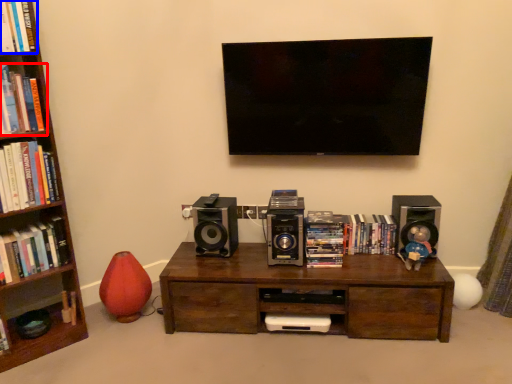
Question: Which point is closer to the camera, book (highlighted by a red box) or book (highlighted by a blue box)?

Choices:
 (A) book
 (B) book

Answer: (B)